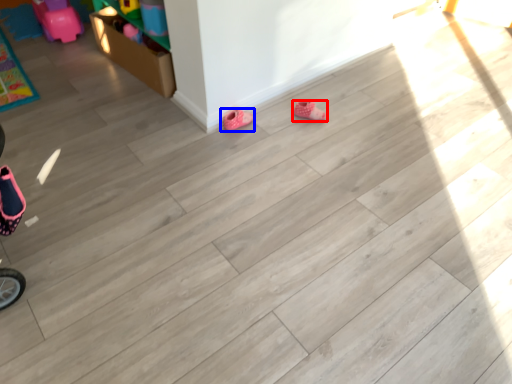
Question: Among these objects, which one is farthest to the camera, footwear (highlighted by a red box) or footwear (highlighted by a blue box)?

Choices:
 (A) footwear
 (B) footwear

Answer: (A)